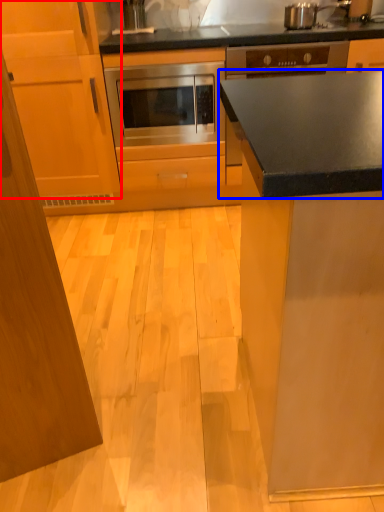
Question: Which object appears closest to the camera in this image, cabinetry (highlighted by a red box) or countertop (highlighted by a blue box)?

Choices:
 (A) cabinetry
 (B) countertop

Answer: (A)